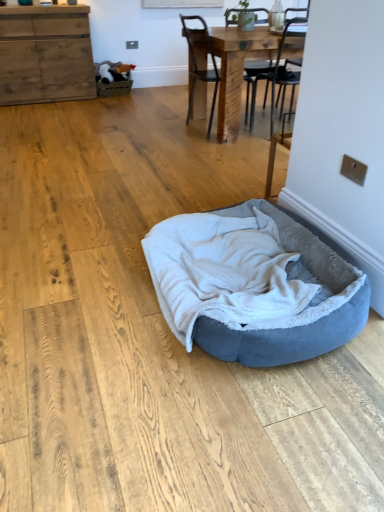
What are the coordinates of `free space in front of black metal chair at upper center` in the screenshot? It's located at (206, 146).